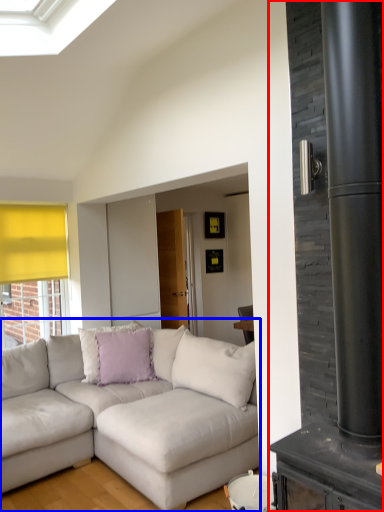
Question: Among these objects, which one is nearest to the camera, fireplace (highlighted by a red box) or studio couch (highlighted by a blue box)?

Choices:
 (A) fireplace
 (B) studio couch

Answer: (A)